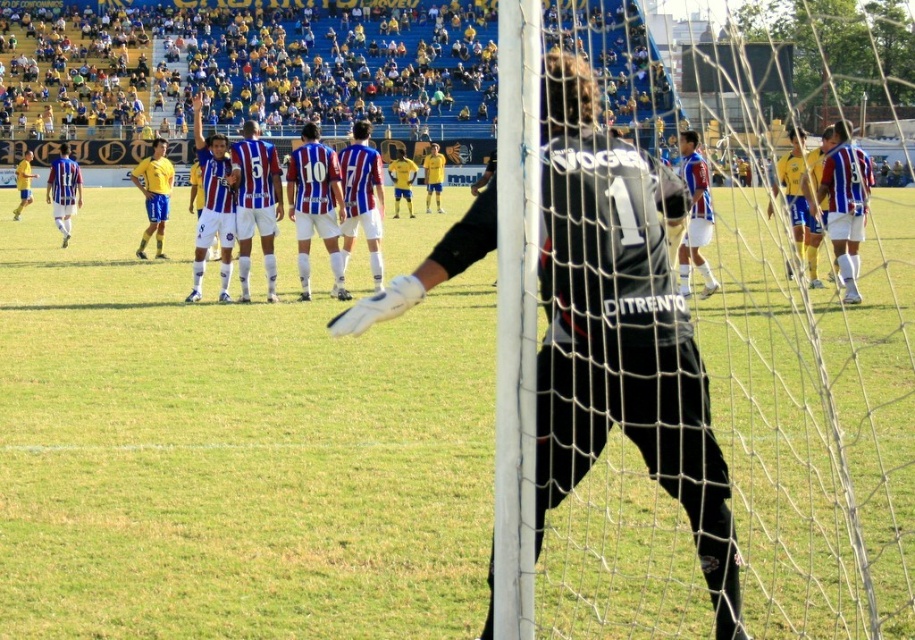
In the scene shown: Which is above, green grass at center or white mesh net at center?

Positioned higher is white mesh net at center.

Locate an element on the screen. This screenshot has height=640, width=915. green grass at center is located at coordinates (232, 449).

Where is `green grass at center`? The height and width of the screenshot is (640, 915). green grass at center is located at coordinates (232, 449).

Can you confirm if striped jersey at right is bigger than blue and white striped jersey at left?

No, striped jersey at right is not bigger than blue and white striped jersey at left.

From the picture: Can you confirm if striped jersey at right is positioned to the left of blue and white striped jersey at left?

In fact, striped jersey at right is to the right of blue and white striped jersey at left.

Who is more distant from viewer, [831,148] or [47,192]?

Positioned behind is point [47,192].

Where is `striped jersey at right`? The height and width of the screenshot is (640, 915). striped jersey at right is located at coordinates (845, 204).

Who is positioned more to the right, white mesh net at center or blue and white striped jersey at left?

white mesh net at center

Can you confirm if white mesh net at center is shorter than blue and white striped jersey at left?

In fact, white mesh net at center may be taller than blue and white striped jersey at left.

Where is `white mesh net at center`? Image resolution: width=915 pixels, height=640 pixels. white mesh net at center is located at coordinates (813, 413).